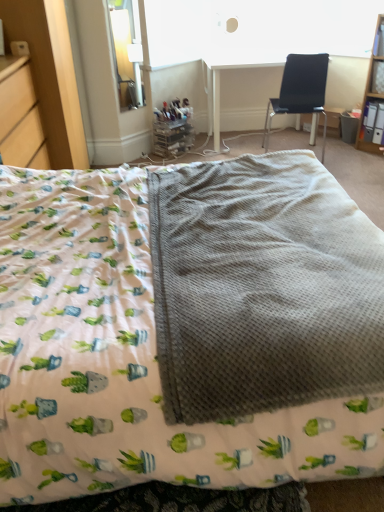
Question: Is black fabric chair at upper right bigger or smaller than clear glass window screen at upper left?

Choices:
 (A) small
 (B) big

Answer: (B)

Question: Choose the correct answer: Is black fabric chair at upper right inside clear glass window screen at upper left or outside it?

Choices:
 (A) outside
 (B) inside

Answer: (A)

Question: Based on their relative distances, which object is nearer to the wooden shelf at upper right?

Choices:
 (A) wooden dresser at left
 (B) white plastic table at upper center
 (C) gray waffle-textured blanket at center
 (D) black fabric chair at upper right
 (E) clear glass window screen at upper left

Answer: (D)

Question: Considering the real-world distances, which object is closest to the waffle-textured blanket at center?

Choices:
 (A) wooden shelf at upper right
 (B) wooden file cabinet at left
 (C) black fabric chair at upper right
 (D) gray waffle-textured blanket at center
 (E) white plastic table at upper center

Answer: (D)